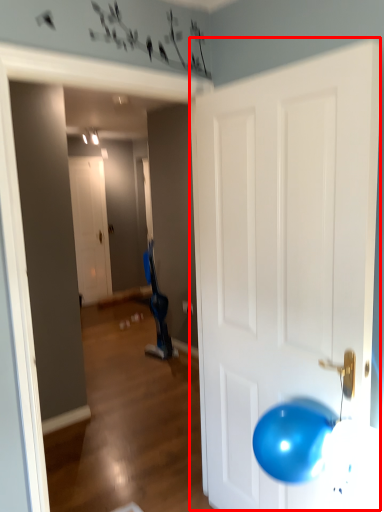
Question: From the image's perspective, where is door (annotated by the red box) located in relation to door in the image?

Choices:
 (A) below
 (B) above

Answer: (A)